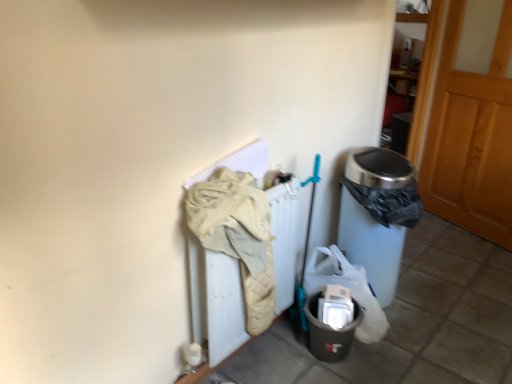
Question: Considering the relative positions of wooden at right and beige quilted blanket at center-left in the image provided, is wooden at right in front of beige quilted blanket at center-left?

Choices:
 (A) yes
 (B) no

Answer: (B)

Question: Considering the relative sizes of wooden at right and beige quilted blanket at center-left in the image provided, is wooden at right bigger than beige quilted blanket at center-left?

Choices:
 (A) yes
 (B) no

Answer: (A)

Question: Does wooden at right have a lesser height compared to beige quilted blanket at center-left?

Choices:
 (A) yes
 (B) no

Answer: (B)

Question: From the image's perspective, is wooden at right located beneath beige quilted blanket at center-left?

Choices:
 (A) no
 (B) yes

Answer: (A)

Question: Is wooden at right further to the viewer compared to beige quilted blanket at center-left?

Choices:
 (A) yes
 (B) no

Answer: (A)

Question: From the image's perspective, is wooden at right on top of beige quilted blanket at center-left?

Choices:
 (A) yes
 (B) no

Answer: (A)

Question: Would you say wooden at right is part of beige quilted blanket at center-left's contents?

Choices:
 (A) yes
 (B) no

Answer: (B)

Question: Considering the relative positions of beige quilted blanket at center-left and wooden at right in the image provided, is beige quilted blanket at center-left to the right of wooden at right from the viewer's perspective?

Choices:
 (A) no
 (B) yes

Answer: (A)

Question: From a real-world perspective, does beige quilted blanket at center-left sit lower than wooden at right?

Choices:
 (A) yes
 (B) no

Answer: (A)

Question: Are beige quilted blanket at center-left and wooden at right making contact?

Choices:
 (A) yes
 (B) no

Answer: (B)

Question: Does beige quilted blanket at center-left come in front of wooden at right?

Choices:
 (A) yes
 (B) no

Answer: (A)

Question: Are beige quilted blanket at center-left and wooden at right located far from each other?

Choices:
 (A) yes
 (B) no

Answer: (A)

Question: Considering the relative sizes of wooden at right and matte gray plastic bin at lower right in the image provided, is wooden at right bigger than matte gray plastic bin at lower right?

Choices:
 (A) yes
 (B) no

Answer: (A)